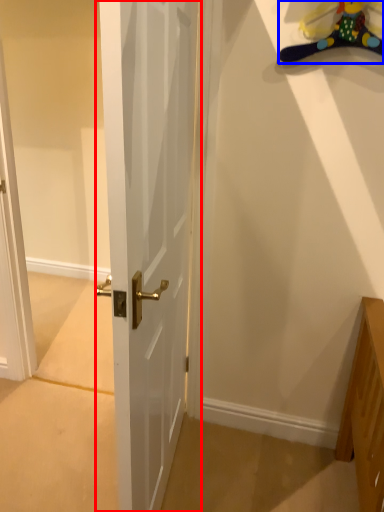
Question: Which object appears farthest to the camera in this image, door (highlighted by a red box) or toy (highlighted by a blue box)?

Choices:
 (A) door
 (B) toy

Answer: (B)